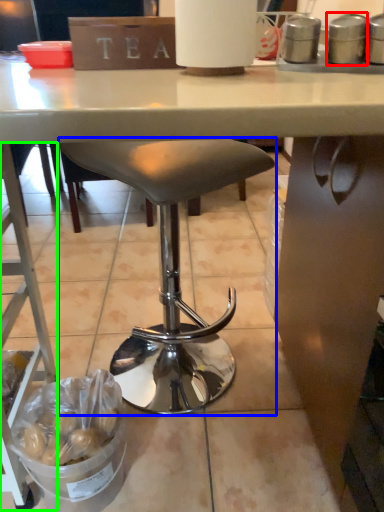
Question: Estimate the real-world distances between objects in this image. Which object is farther from appliance (highlighted by a red box), stool (highlighted by a blue box) or ladder (highlighted by a green box)?

Choices:
 (A) stool
 (B) ladder

Answer: (B)